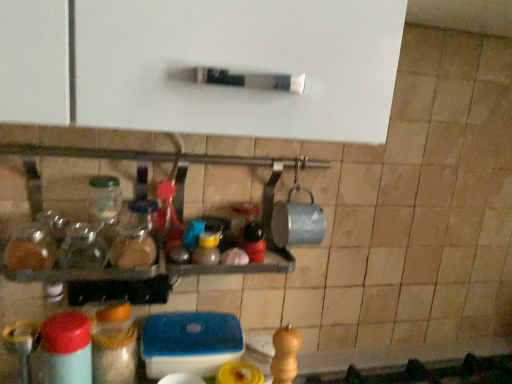
Question: Can you confirm if matte plastic bottle at lower left, placed as the third bottle when sorted from top to bottom, is taller than translucent glass jar at center, the 1th bottle viewed from the top?

Choices:
 (A) yes
 (B) no

Answer: (A)

Question: Is matte plastic bottle at lower left, placed as the third bottle when sorted from top to bottom, positioned beyond the bounds of translucent glass jar at center, marked as the third bottle in a bottom-to-top arrangement?

Choices:
 (A) yes
 (B) no

Answer: (A)

Question: From a real-world perspective, is matte plastic bottle at lower left, placed as the third bottle when sorted from top to bottom, physically below translucent glass jar at center, the 1th bottle viewed from the top?

Choices:
 (A) yes
 (B) no

Answer: (A)

Question: Is the position of matte plastic bottle at lower left, the first bottle when ordered from bottom to top, more distant than that of translucent glass jar at center, marked as the third bottle in a bottom-to-top arrangement?

Choices:
 (A) yes
 (B) no

Answer: (B)

Question: Does matte plastic bottle at lower left, the first bottle when ordered from bottom to top, have a lesser width compared to translucent glass jar at center, marked as the third bottle in a bottom-to-top arrangement?

Choices:
 (A) no
 (B) yes

Answer: (B)

Question: Does matte plastic bottle at lower left, the first bottle when ordered from bottom to top, have a greater width compared to translucent glass jar at center, the 1th bottle viewed from the top?

Choices:
 (A) no
 (B) yes

Answer: (A)

Question: Considering the relative sizes of translucent plastic container at lower center, acting as the 2th bottle starting from the top, and translucent glass jar at center, marked as the third bottle in a bottom-to-top arrangement, in the image provided, is translucent plastic container at lower center, acting as the 2th bottle starting from the top, thinner than translucent glass jar at center, marked as the third bottle in a bottom-to-top arrangement,?

Choices:
 (A) yes
 (B) no

Answer: (A)

Question: Does translucent plastic container at lower center, acting as the 2th bottle starting from the top, have a smaller size compared to translucent glass jar at center, the 1th bottle viewed from the top?

Choices:
 (A) yes
 (B) no

Answer: (B)

Question: Is translucent plastic container at lower center, acting as the 2th bottle starting from the top, aimed at translucent glass jar at center, the 1th bottle viewed from the top?

Choices:
 (A) no
 (B) yes

Answer: (A)

Question: Is translucent plastic container at lower center, the second bottle from the bottom, taller than translucent glass jar at center, marked as the third bottle in a bottom-to-top arrangement?

Choices:
 (A) yes
 (B) no

Answer: (A)

Question: Does translucent plastic container at lower center, acting as the 2th bottle starting from the top, have a greater width compared to translucent glass jar at center, the 1th bottle viewed from the top?

Choices:
 (A) yes
 (B) no

Answer: (B)

Question: From the image's perspective, is translucent plastic container at lower center, the second bottle from the bottom, on top of translucent glass jar at center, the 1th bottle viewed from the top?

Choices:
 (A) yes
 (B) no

Answer: (B)

Question: From the image's perspective, is translucent plastic container at lower center, the second bottle from the bottom, under matte plastic bottle at lower left, placed as the third bottle when sorted from top to bottom?

Choices:
 (A) no
 (B) yes

Answer: (A)